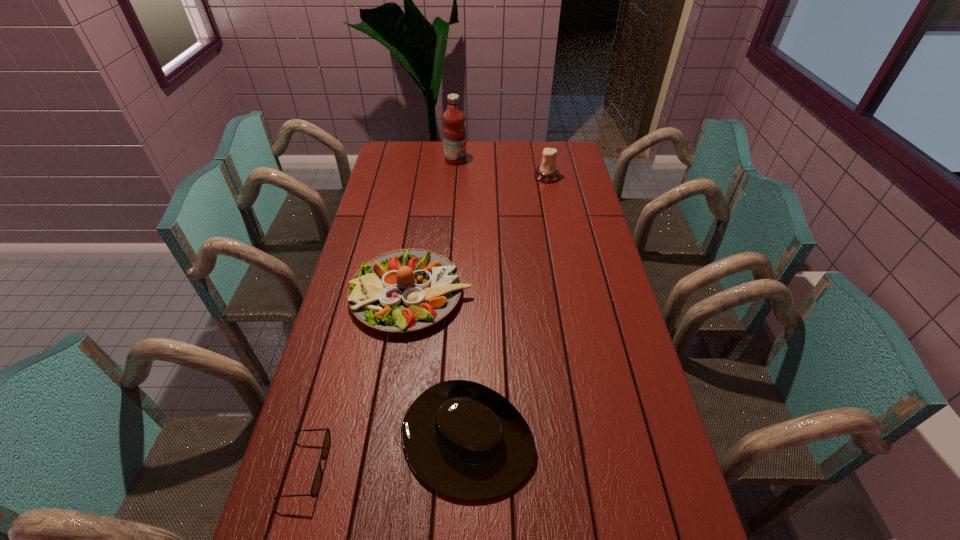
In the image, there is a desktop. Where is `vacant space at the far left corner`? vacant space at the far left corner is located at coordinates (412, 168).

Find the location of a particular element. vacant space at the far right corner of the desktop is located at coordinates (575, 154).

Where is `empty space between the third shortest object and the second shortest object`? The width and height of the screenshot is (960, 540). empty space between the third shortest object and the second shortest object is located at coordinates (439, 368).

Where is `vacant region between the shortest object and the third shortest object`? The image size is (960, 540). vacant region between the shortest object and the third shortest object is located at coordinates (359, 381).

Where is `vacant space that is in between the shortest object and the third farthest object`? The image size is (960, 540). vacant space that is in between the shortest object and the third farthest object is located at coordinates (359, 381).

The height and width of the screenshot is (540, 960). I want to click on free spot between the salad plate and the fourth nearest object, so point(479,235).

Image resolution: width=960 pixels, height=540 pixels. Identify the location of free space between the fruit juice and the rightmost object. (501, 168).

Image resolution: width=960 pixels, height=540 pixels. In order to click on blank region between the farthest object and the fourth nearest object in this screenshot , I will do `click(501, 168)`.

I want to click on free space between the sunglasses and the third tallest object, so click(359, 381).

Find the location of `empty space that is in between the cowboy hat and the farthest object`. empty space that is in between the cowboy hat and the farthest object is located at coordinates (462, 301).